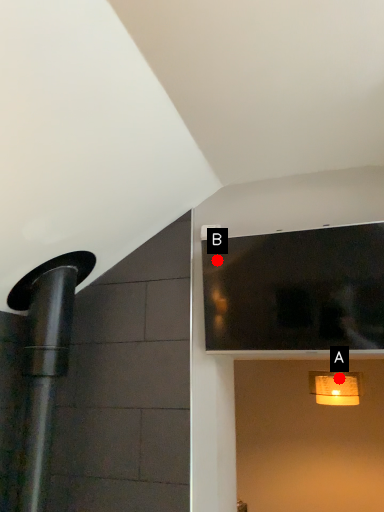
Question: Two points are circled on the image, labeled by A and B beside each circle. Which point appears farthest from the camera in this image?

Choices:
 (A) A is further
 (B) B is further

Answer: (A)